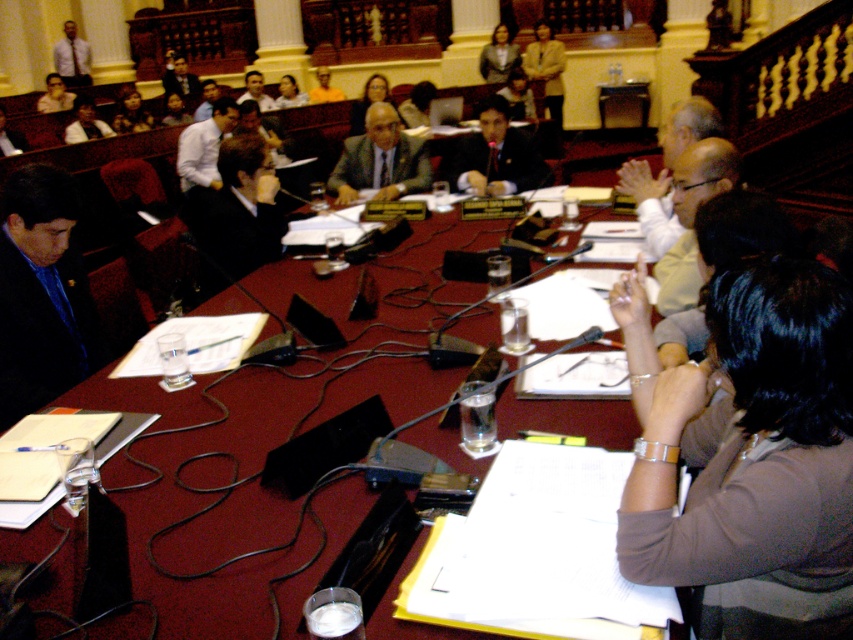
Question: Is maroon fabric table at center to the right of orange shirt at center from the viewer's perspective?

Choices:
 (A) yes
 (B) no

Answer: (A)

Question: Can you confirm if matte black suit at left is thinner than light brown textured blazer at upper center?

Choices:
 (A) yes
 (B) no

Answer: (A)

Question: Which of the following is the closest to the observer?

Choices:
 (A) orange shirt at center
 (B) matte gray blazer at upper center
 (C) white shirt at upper left
 (D) maroon fabric table at center

Answer: (D)

Question: Does dark brown suit at center have a smaller size compared to light brown textured blazer at upper center?

Choices:
 (A) no
 (B) yes

Answer: (A)

Question: Which of these objects is positioned closest to the brown fabric shirt at lower right?

Choices:
 (A) matte gray suit at center
 (B) orange shirt at center
 (C) dark brown suit at center

Answer: (C)

Question: Which object appears closest to the camera in this image?

Choices:
 (A) matte black suit at left
 (B) dark brown suit at center

Answer: (A)